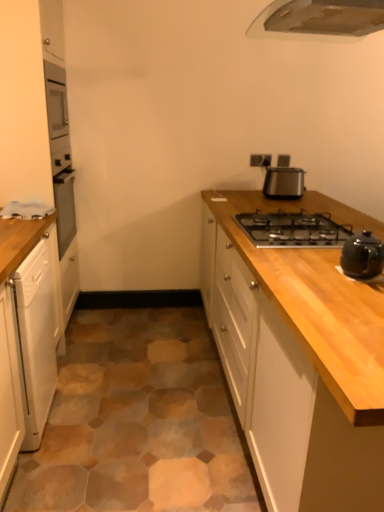
At what (x,y) coordinates should I click in order to perform the action: click on vacant space in front of black ceramic teapot at right, which is the 2th kitchen appliance from top to bottom. Please return your answer as a coordinate pair (x, y). Looking at the image, I should click on (360, 294).